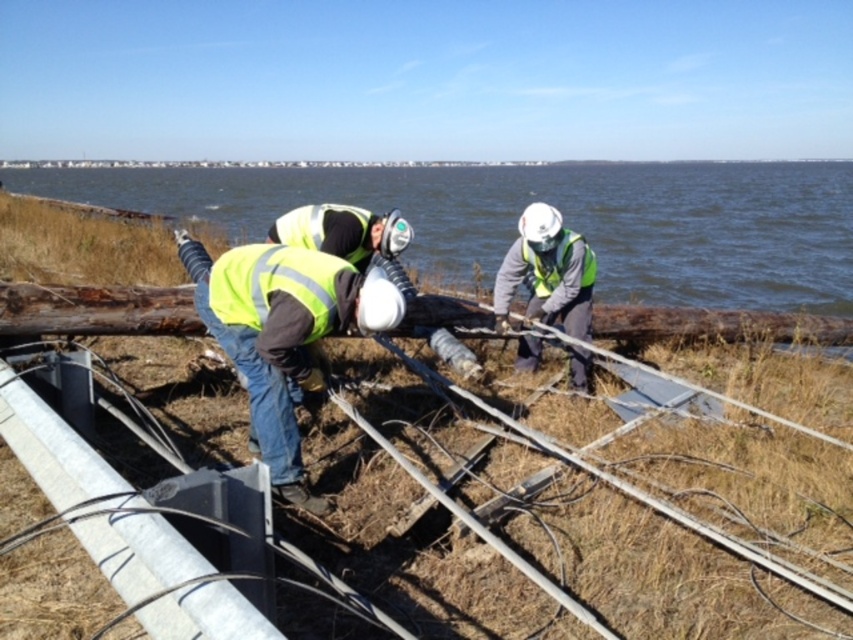
You are a construction supervisor reviewing this site. You see the point marked at coordinates [561,212]. What does this point indicate in the scene?

The point at coordinates [561,212] indicates blue water at center.

Consider the image. You are a safety inspector observing the construction site. You notice the blue water at center and the reflective yellow safety vest at center. Which object is positioned closer to your viewpoint?

The blue water at center is closer to the viewer than the reflective yellow safety vest at center.

You are a safety inspector standing at the construction site. You need to ensure that the blue water at center is at least 6 meters away from the workers to comply with safety regulations. Based on the scene, is the current distance compliant?

The blue water at center is 5.91 meters away from the viewer, which is slightly less than the required 6 meters. Therefore, the current distance does not comply with safety regulations.